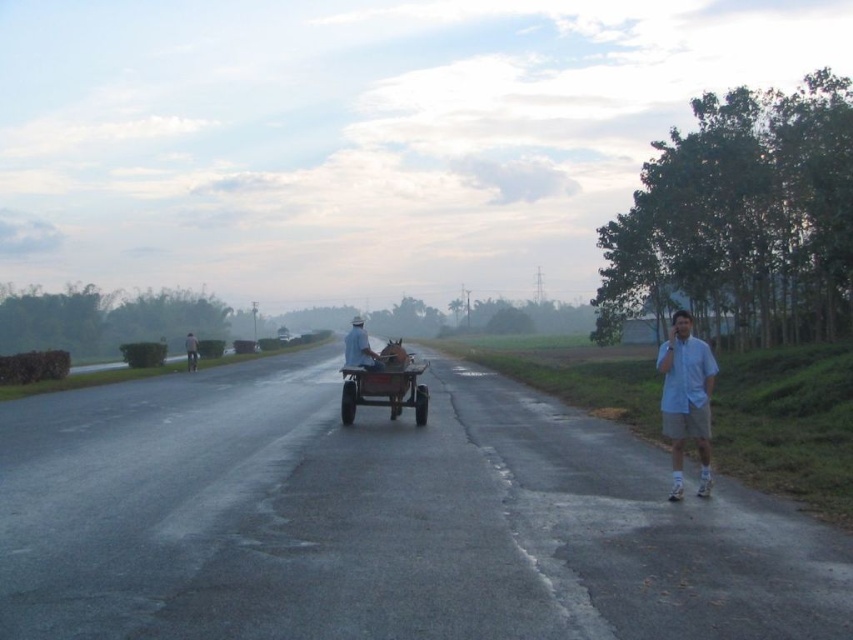
Question: Which object appears closest to the camera in this image?

Choices:
 (A) light blue shirt at right
 (B) white cotton shirt at center

Answer: (A)

Question: Can you confirm if light blue shirt at right is smaller than white cotton shirt at center?

Choices:
 (A) yes
 (B) no

Answer: (A)

Question: Which point appears closest to the camera in this image?

Choices:
 (A) (354, 376)
 (B) (689, 353)
 (C) (352, 339)

Answer: (B)

Question: Where is brown wooden horse cart at center located in relation to white cotton shirt at center in the image?

Choices:
 (A) below
 (B) above

Answer: (A)

Question: Estimate the real-world distances between objects in this image. Which object is farther from the white fabric at center?

Choices:
 (A) white cotton shirt at center
 (B) brown wooden horse cart at center

Answer: (A)

Question: Does brown wooden horse cart at center have a greater width compared to white fabric at center?

Choices:
 (A) no
 (B) yes

Answer: (A)